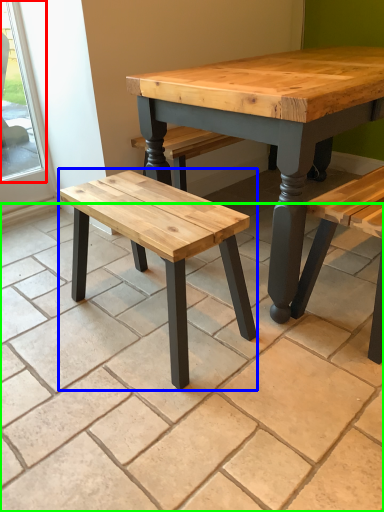
Question: Based on their relative distances, which object is nearer to window (highlighted by a red box)? Choose from stool (highlighted by a blue box) and tile (highlighted by a green box).

Choices:
 (A) stool
 (B) tile

Answer: (B)